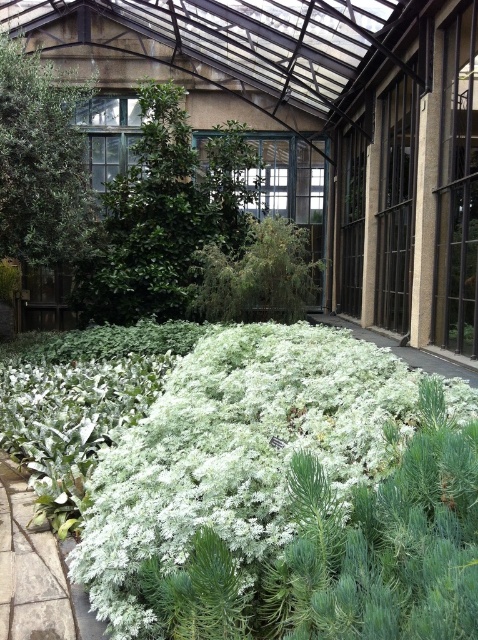
Does white fluffy plant at center have a greater width compared to green fuzzy bush at center?

No, white fluffy plant at center is not wider than green fuzzy bush at center.

Identify the location of white fluffy plant at center. The height and width of the screenshot is (640, 478). (265, 488).